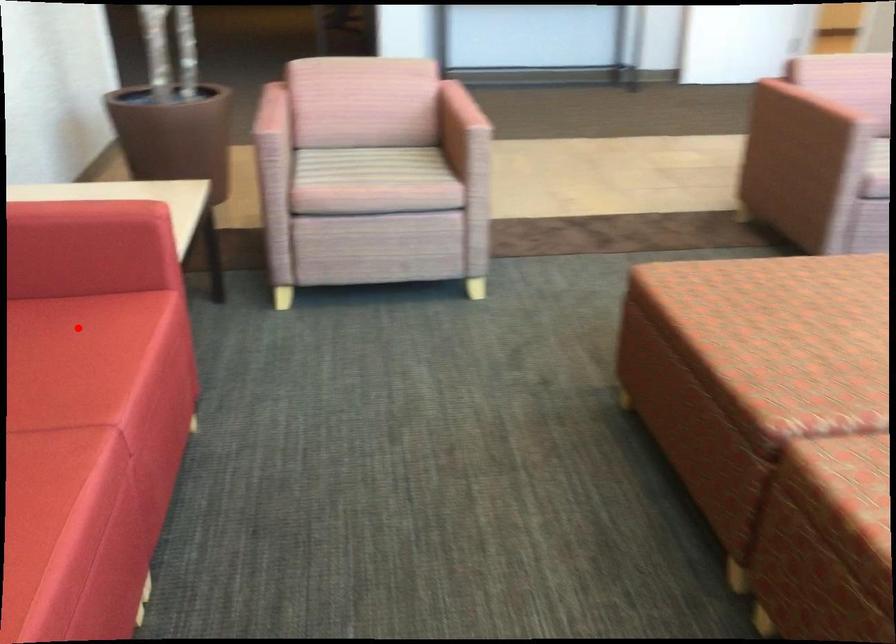
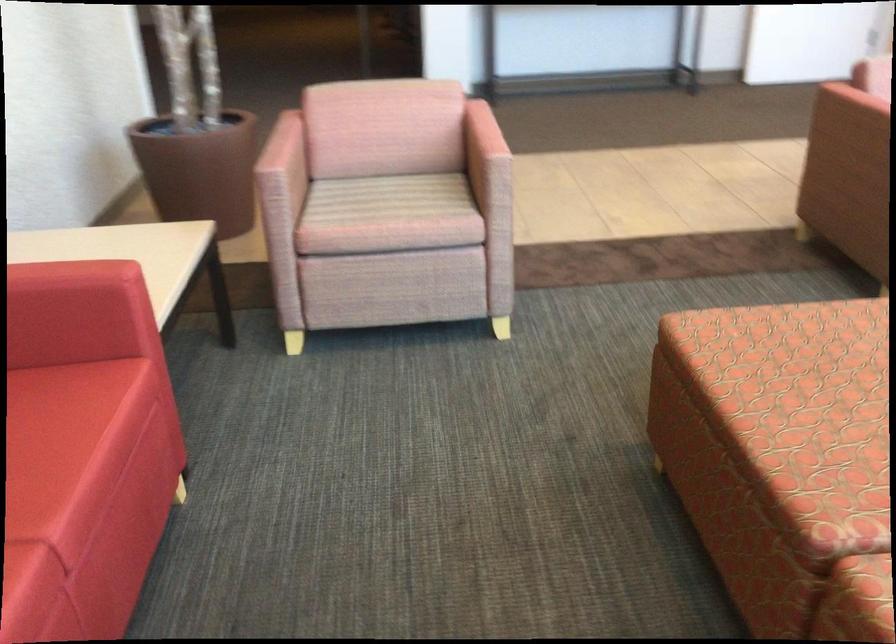
Locate, in the second image, the point that corresponds to the highlighted location in the first image.

(38, 408)